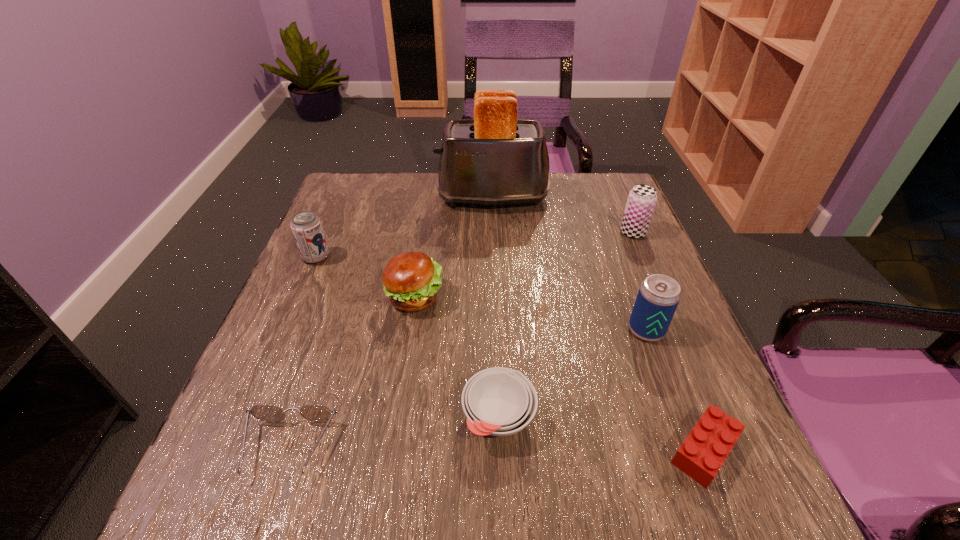
You are a GUI agent. You are given a task and a screenshot of the screen. Output one action in this format:
    pyautogui.click(x=<x>, y=<y>)
    Task: Click on the vacant space at the right edge of the desktop
    The height and width of the screenshot is (540, 960).
    Given the screenshot: What is the action you would take?
    pyautogui.click(x=594, y=222)

In the image, there is a desktop. Where is `vacant region at the far left corner`? The image size is (960, 540). vacant region at the far left corner is located at coordinates coord(358,218).

This screenshot has height=540, width=960. Identify the location of free location at the far right corner of the desktop. (609, 212).

In order to click on vacant point located between the second farthest object and the leftmost beer can in this screenshot , I will do `click(474, 245)`.

The image size is (960, 540). I want to click on free space that is in between the third farthest object and the toaster, so click(x=404, y=228).

The image size is (960, 540). What are the coordinates of `empty space between the spectacles and the sixth nearest object` in the screenshot? It's located at (302, 353).

Image resolution: width=960 pixels, height=540 pixels. I want to click on unoccupied area between the toaster and the Lego, so click(598, 324).

Where is `free space between the leftmost beer can and the seventh nearest object`? The height and width of the screenshot is (540, 960). free space between the leftmost beer can and the seventh nearest object is located at coordinates (474, 245).

I want to click on vacant space in between the hamburger and the spectacles, so click(x=351, y=373).

Locate an element on the screen. blank region between the second farthest object and the Lego is located at coordinates (668, 341).